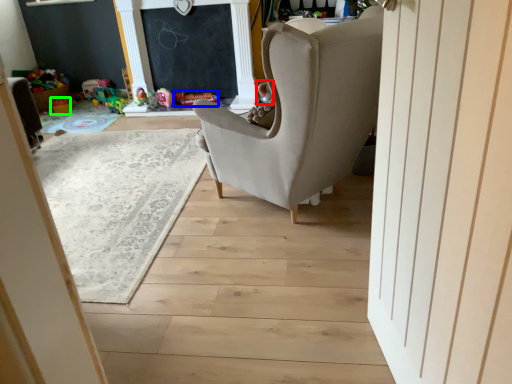
Question: Which is nearer to the toy (highlighted by a red box)? toy (highlighted by a blue box) or toy (highlighted by a green box).

Choices:
 (A) toy
 (B) toy

Answer: (A)